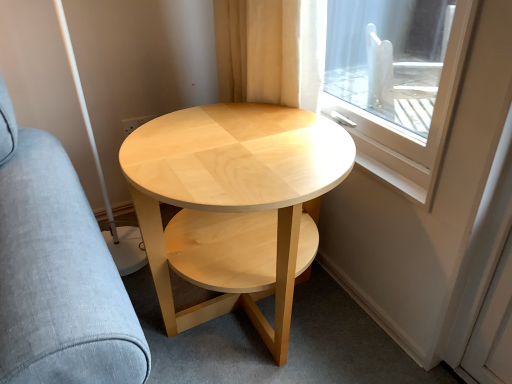
Question: Is light gray fabric swivel chair at left placed right next to natural wood coffee table at center?

Choices:
 (A) yes
 (B) no

Answer: (B)

Question: Does light gray fabric swivel chair at left appear on the left side of natural wood coffee table at center?

Choices:
 (A) no
 (B) yes

Answer: (B)

Question: Is light gray fabric swivel chair at left further to the viewer compared to natural wood coffee table at center?

Choices:
 (A) no
 (B) yes

Answer: (A)

Question: Is light gray fabric swivel chair at left shorter than natural wood coffee table at center?

Choices:
 (A) no
 (B) yes

Answer: (A)

Question: From the image's perspective, is light gray fabric swivel chair at left on top of natural wood coffee table at center?

Choices:
 (A) yes
 (B) no

Answer: (A)

Question: From a real-world perspective, is light gray fabric swivel chair at left on top of natural wood coffee table at center?

Choices:
 (A) yes
 (B) no

Answer: (A)

Question: Is natural wood coffee table at center surrounding light gray fabric swivel chair at left?

Choices:
 (A) no
 (B) yes

Answer: (A)

Question: From a real-world perspective, is natural wood coffee table at center located beneath light gray fabric swivel chair at left?

Choices:
 (A) yes
 (B) no

Answer: (A)

Question: Is natural wood coffee table at center positioned far away from light gray fabric swivel chair at left?

Choices:
 (A) no
 (B) yes

Answer: (A)

Question: Does natural wood coffee table at center lie in front of light gray fabric swivel chair at left?

Choices:
 (A) yes
 (B) no

Answer: (B)

Question: Is natural wood coffee table at center smaller than light gray fabric swivel chair at left?

Choices:
 (A) no
 (B) yes

Answer: (B)

Question: Does natural wood coffee table at center have a greater width compared to light gray fabric swivel chair at left?

Choices:
 (A) yes
 (B) no

Answer: (B)

Question: Does point (70, 190) appear closer or farther from the camera than point (310, 175)?

Choices:
 (A) farther
 (B) closer

Answer: (B)